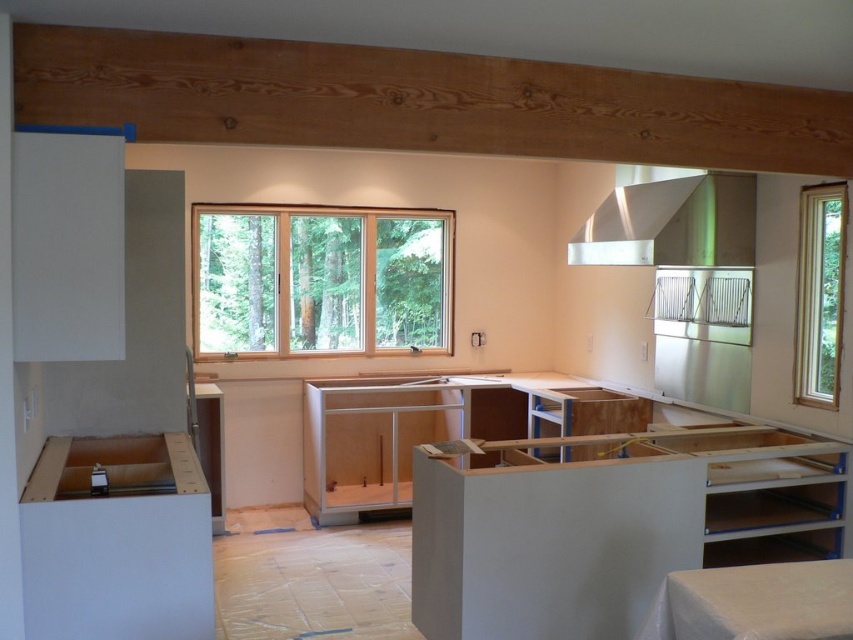
Question: Considering the real-world distances, which object is closest to the clear glass window at right?

Choices:
 (A) clear glass window at center
 (B) natural wood beam at upper center
 (C) satin silver exhaust hood at upper right

Answer: (C)

Question: Which object appears closest to the camera in this image?

Choices:
 (A) natural wood beam at upper center
 (B) satin silver exhaust hood at upper right

Answer: (A)

Question: Can you confirm if satin silver exhaust hood at upper right is positioned above clear glass window at right?

Choices:
 (A) yes
 (B) no

Answer: (A)

Question: Which of the following is the closest to the observer?

Choices:
 (A) clear glass window at right
 (B) clear glass window at center

Answer: (A)

Question: Considering the relative positions of clear glass window at center and clear glass window at right in the image provided, where is clear glass window at center located with respect to clear glass window at right?

Choices:
 (A) right
 (B) left

Answer: (B)

Question: Is clear glass window at center closer to the viewer compared to satin silver exhaust hood at upper right?

Choices:
 (A) no
 (B) yes

Answer: (A)